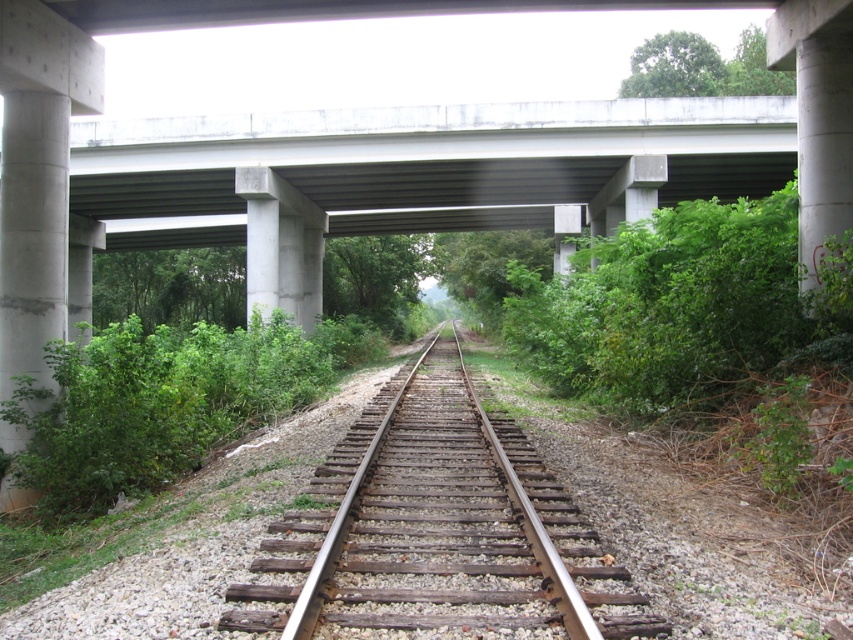
From the picture: You are a construction worker inspecting the railway area. You need to determine which object between the rusty metal train track at center and the concrete at left requires more material for maintenance. Based on their sizes, which one would need more resources?

The rusty metal train track at center is larger in size than the concrete at left, so it would require more material for maintenance.

In the scene shown: You are a construction worker assessing the railway. You need to determine if the rusty metal train track at center is positioned under the concrete at center. Based on the scene, what is the relationship between these two structures?

The rusty metal train track at center is below concrete at center, indicating that the concrete is positioned above it, likely part of the overpass structure mentioned in the scene description.